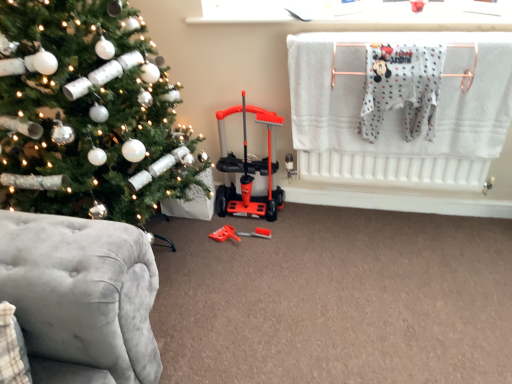
Question: Is orange plastic baby carriage at center at the left side of white cotton onesie at upper right?

Choices:
 (A) no
 (B) yes

Answer: (B)

Question: Can you confirm if orange plastic baby carriage at center is shorter than white cotton onesie at upper right?

Choices:
 (A) no
 (B) yes

Answer: (A)

Question: Is orange plastic baby carriage at center to the right of white cotton onesie at upper right from the viewer's perspective?

Choices:
 (A) yes
 (B) no

Answer: (B)

Question: Is orange plastic baby carriage at center completely or partially outside of white cotton onesie at upper right?

Choices:
 (A) no
 (B) yes

Answer: (B)

Question: From a real-world perspective, is orange plastic baby carriage at center located beneath white cotton onesie at upper right?

Choices:
 (A) no
 (B) yes

Answer: (B)

Question: From a real-world perspective, is orange plastic baby carriage at center on white cotton onesie at upper right?

Choices:
 (A) yes
 (B) no

Answer: (B)

Question: Considering the relative positions of orange plastic toy at center and white cotton onesie at upper right in the image provided, is orange plastic toy at center behind white cotton onesie at upper right?

Choices:
 (A) yes
 (B) no

Answer: (A)

Question: Can you confirm if orange plastic toy at center is smaller than white cotton onesie at upper right?

Choices:
 (A) no
 (B) yes

Answer: (B)

Question: Is orange plastic toy at center in front of white cotton onesie at upper right?

Choices:
 (A) no
 (B) yes

Answer: (A)

Question: Considering the relative sizes of orange plastic toy at center and white cotton onesie at upper right in the image provided, is orange plastic toy at center taller than white cotton onesie at upper right?

Choices:
 (A) no
 (B) yes

Answer: (A)

Question: Are orange plastic toy at center and white cotton onesie at upper right far apart?

Choices:
 (A) yes
 (B) no

Answer: (A)

Question: Is orange plastic toy at center aimed at white cotton onesie at upper right?

Choices:
 (A) no
 (B) yes

Answer: (A)

Question: Is orange plastic toy at center surrounded by white cotton onesie at upper right?

Choices:
 (A) yes
 (B) no

Answer: (B)